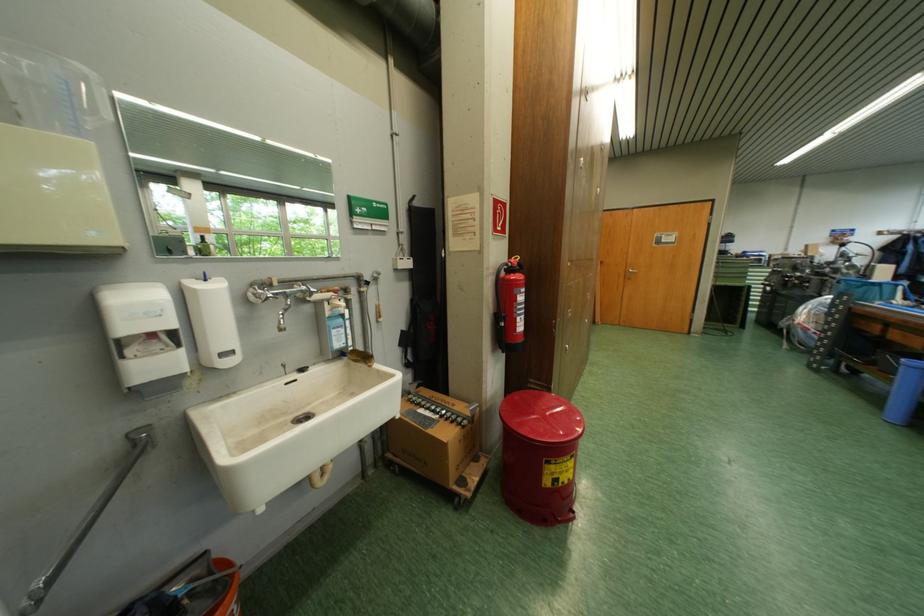
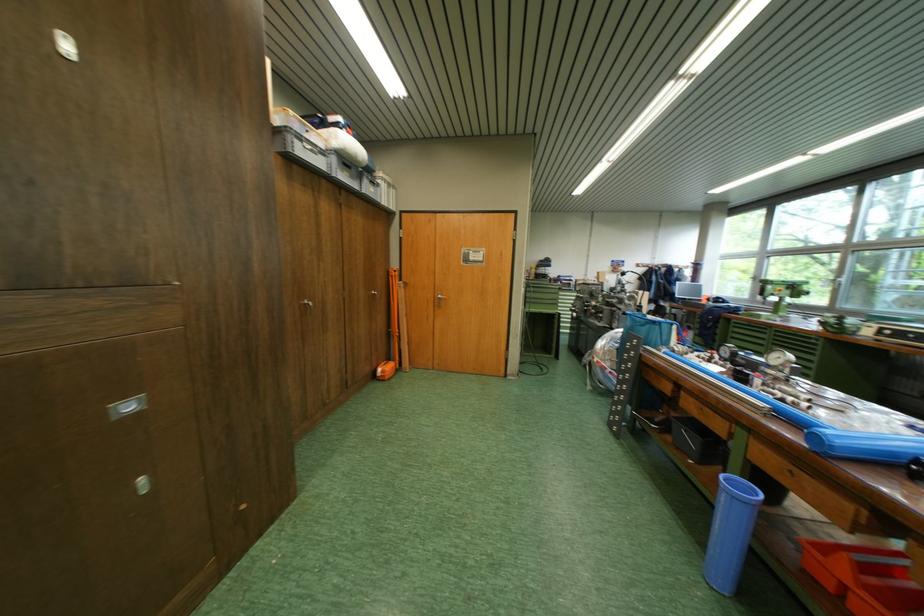
Which direction would the cameraman need to move to produce the second image?

The cameraman moved toward right, forward.